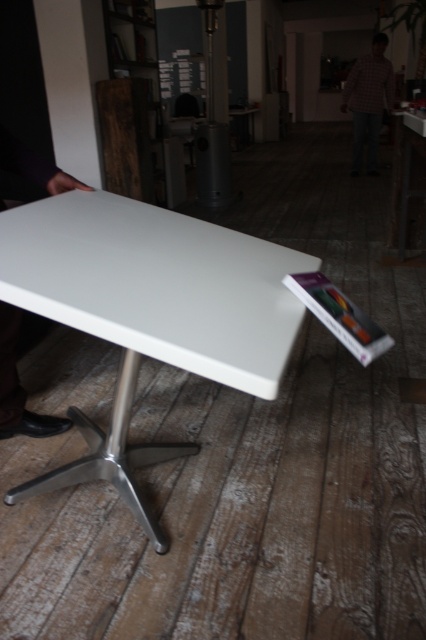
You are standing in a room and see the white glossy table at center and the checkered shirt at center. Which object is closer to you?

The checkered shirt at center is closer to you because it is positioned above the white glossy table at center.

You are a delivery person holding a package that requires a flat surface to place. You see the white glossy table at right and the checkered shirt at center. Which surface is suitable for placing the package?

The white glossy table at right is suitable for placing the package since it is a flat surface, whereas the checkered shirt at center is likely clothing and not a stable surface.

You are standing in the room and want to place a small vase on the table. Given the positions of the white glossy table at right and the checkered shirt at center, which direction should you move towards to reach the table?

The white glossy table at right is to the left of the checkered shirt at center, so you should move towards the left direction to reach the table.